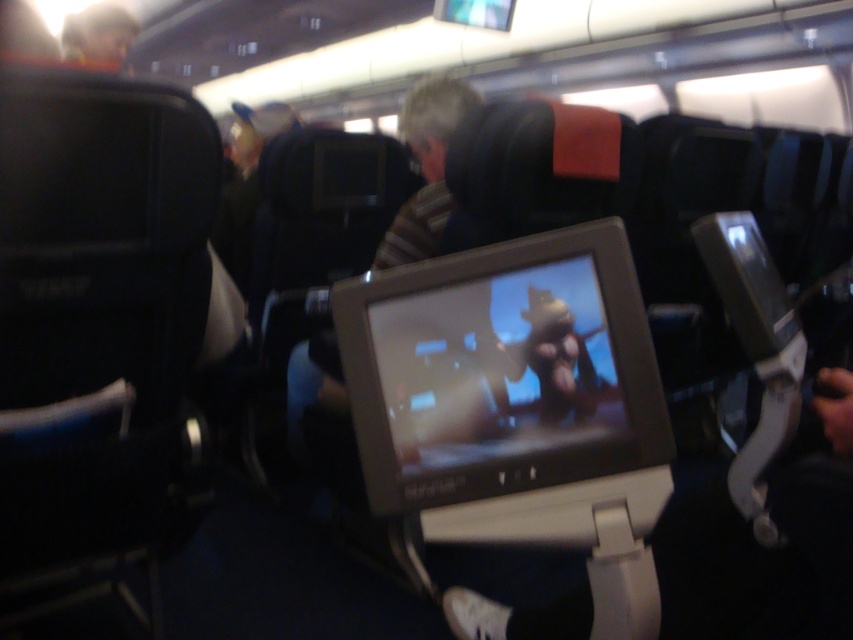
You are seated in an airplane cabin and want to reach a point marked at coordinates point (x=560, y=364). If your arm can extend 36 inches, can you comfortably reach that point?

The distance of point (x=560, y=364) from camera is 36.87 inches. Since your arm can only extend 36 inches, you cannot comfortably reach that point as it is slightly farther than your arm length.

You are seated in the airplane cabin and want to locate two specific points on the entertainment screen. The first point is at coordinates point (589, 440) and the second is at point (90, 45). Which point is nearer to your eyes?

Point (589, 440) is closer to the viewer than point (90, 45).

You are seated in an airplane cabin and want to grab the smooth plastic toy at upper left without touching the matte plastic screen at center. Is this possible given their positions?

The matte plastic screen at center is closer to the viewer than the smooth plastic toy at upper left, so you can reach the smooth plastic toy at upper left without touching the matte plastic screen at center by extending your arm beyond the screen.